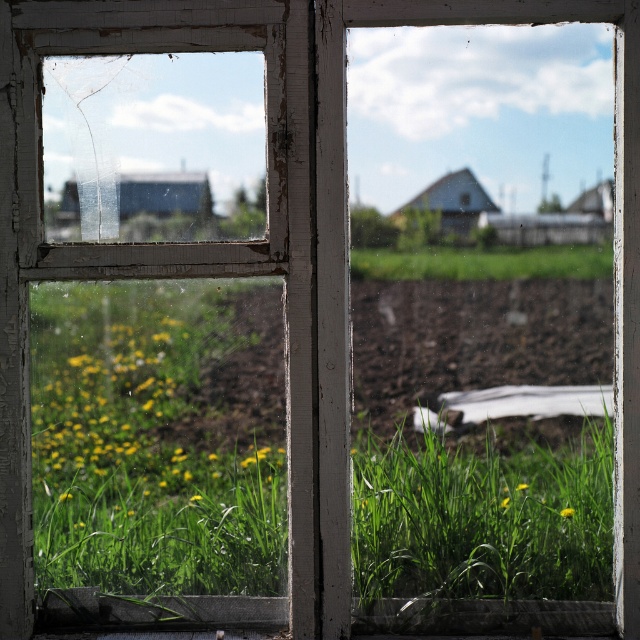
Question: Which point is farther to the camera?

Choices:
 (A) (579, 260)
 (B) (154, 600)

Answer: (B)

Question: Is smooth concrete sill at lower center smaller than green grass at center?

Choices:
 (A) yes
 (B) no

Answer: (B)

Question: Is smooth concrete sill at lower center closer to the viewer compared to green grass at center?

Choices:
 (A) no
 (B) yes

Answer: (A)

Question: From the image, what is the correct spatial relationship of smooth concrete sill at lower center in relation to green grass at center?

Choices:
 (A) right
 (B) left

Answer: (B)